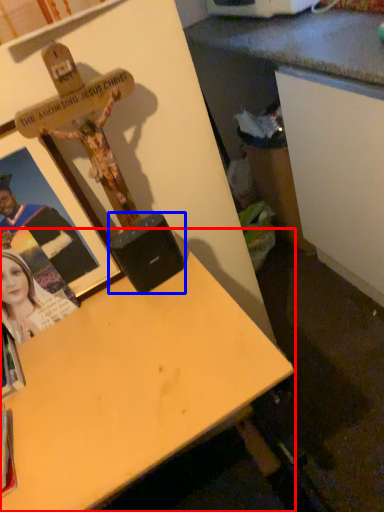
Question: Which object appears farthest to the camera in this image, desk (highlighted by a red box) or speaker (highlighted by a blue box)?

Choices:
 (A) desk
 (B) speaker

Answer: (B)